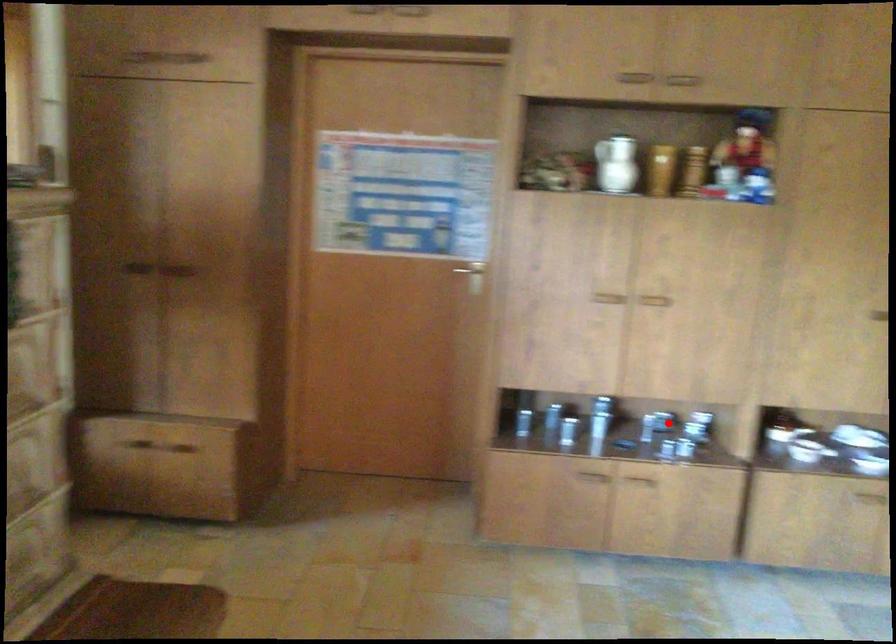
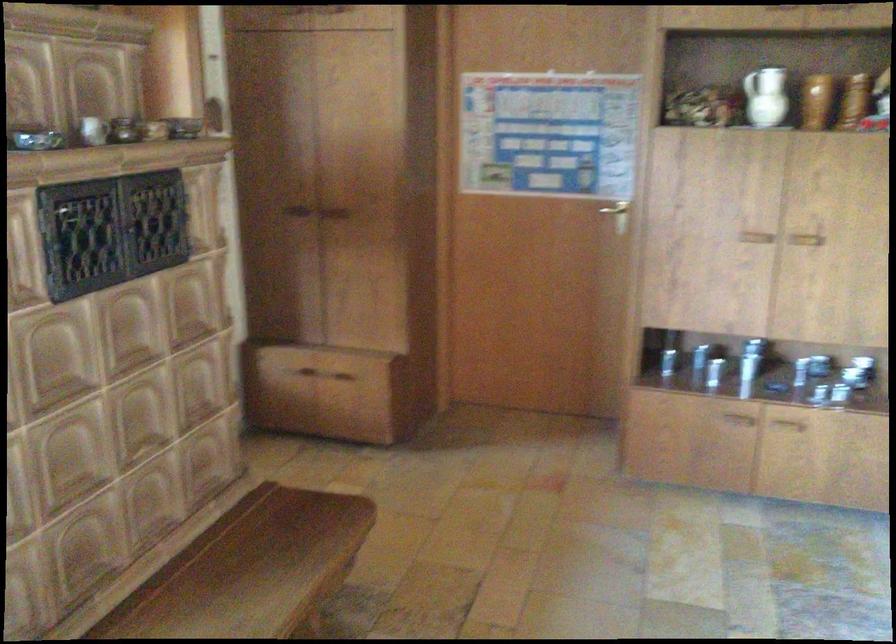
In the second image, find the point that corresponds to the highlighted location in the first image.

(820, 365)